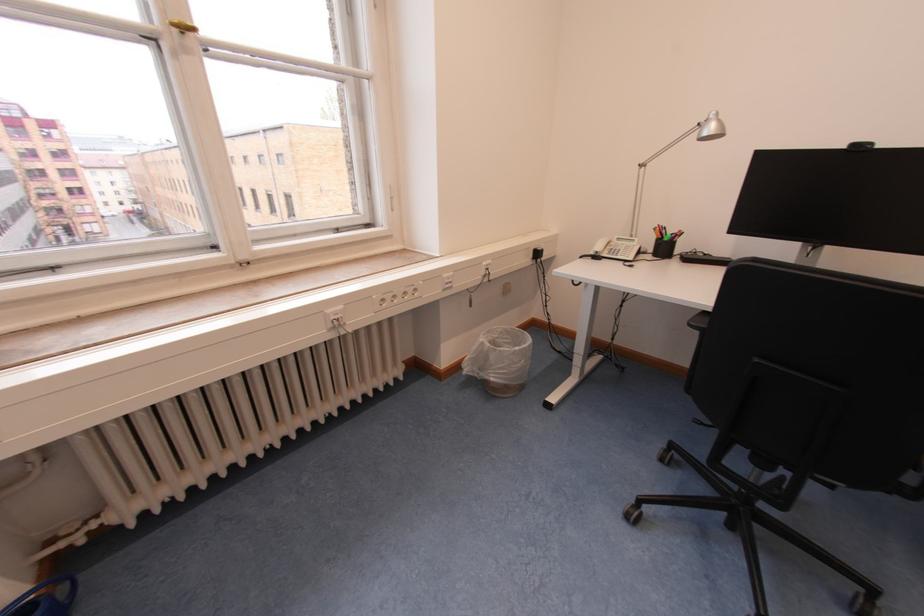
Describe the element at coordinates (616, 248) in the screenshot. The image size is (924, 616). I see `a telephone handset` at that location.